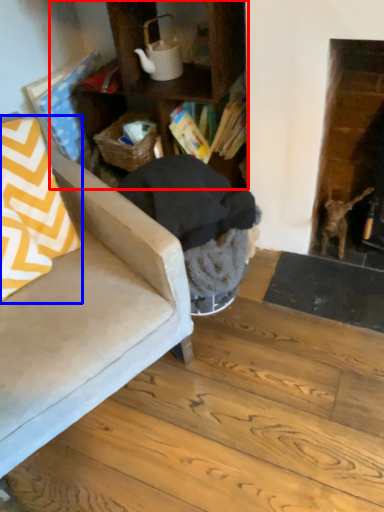
Question: Which object is further to the camera taking this photo, cabinetry (highlighted by a red box) or throw pillow (highlighted by a blue box)?

Choices:
 (A) cabinetry
 (B) throw pillow

Answer: (A)